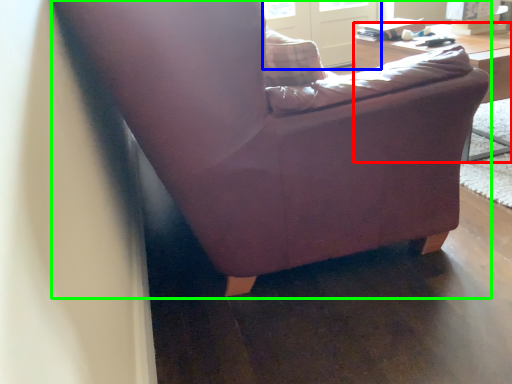
Question: Which object is positioned closest to table (highlighted by a red box)? Select from screen door (highlighted by a blue box) and chair (highlighted by a green box).

Choices:
 (A) screen door
 (B) chair

Answer: (B)